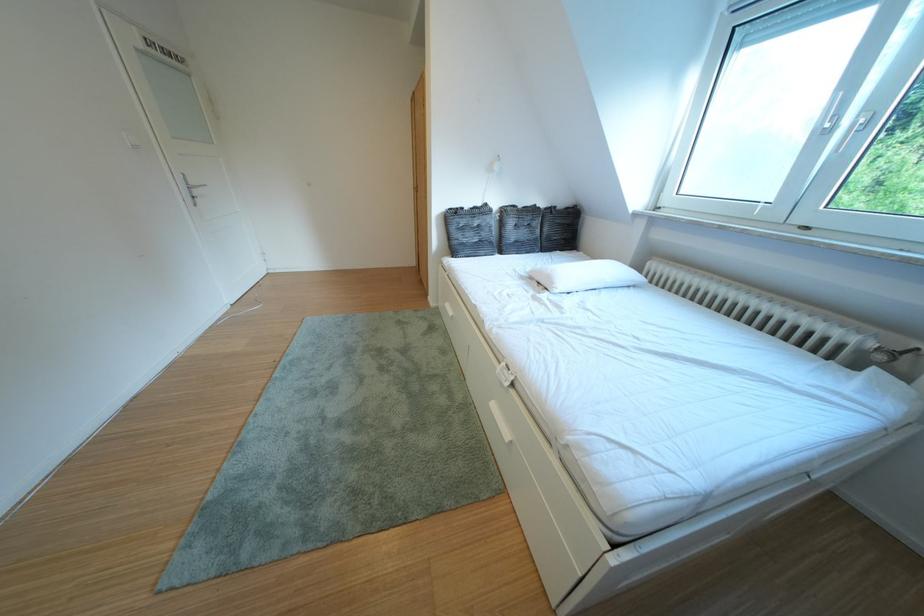
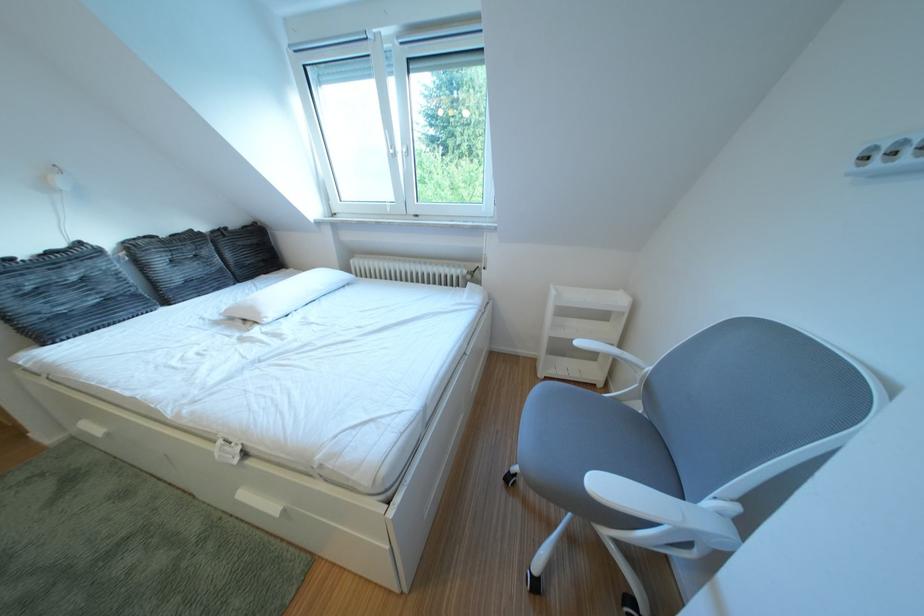
In the second image, find the point that corresponds to point 500,209 in the first image.

(93, 249)